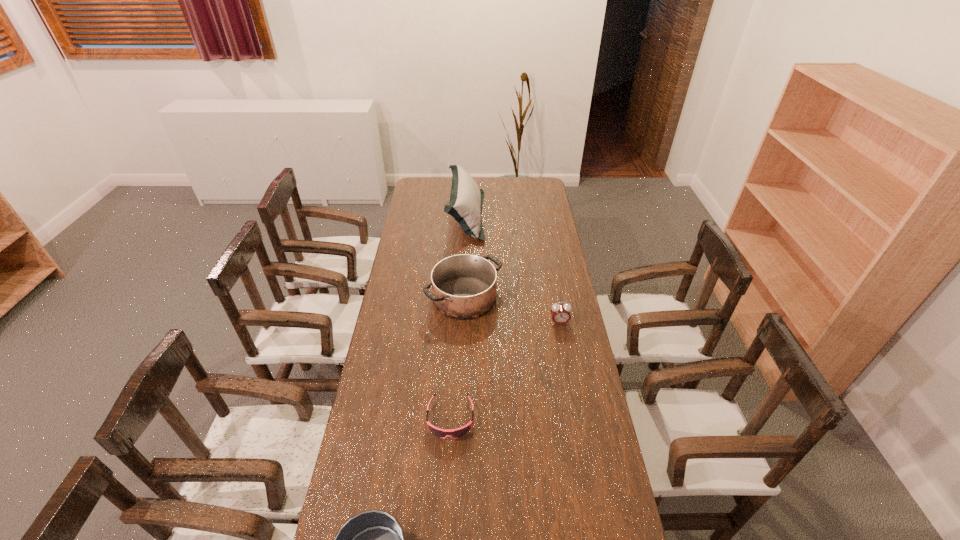
The width and height of the screenshot is (960, 540). Find the location of `object located at the far edge`. object located at the far edge is located at coordinates (466, 199).

Where is `object at the right edge`? object at the right edge is located at coordinates (560, 313).

In the image, there is a desktop. What are the coordinates of `vacant space at the left edge` in the screenshot? It's located at (398, 246).

You are a GUI agent. You are given a task and a screenshot of the screen. Output one action in this format:
    pyautogui.click(x=<x>, y=<y>)
    Task: Click on the free space at the right edge
    The height and width of the screenshot is (540, 960).
    Given the screenshot: What is the action you would take?
    pyautogui.click(x=537, y=231)

At what (x,y) coordinates should I click in order to perform the action: click on free space at the far left corner of the desktop. Please return your answer as a coordinate pair (x, y). The image size is (960, 540). Looking at the image, I should click on (412, 192).

The height and width of the screenshot is (540, 960). Find the location of `free space at the far right corner`. free space at the far right corner is located at coordinates coord(522,177).

Locate an element on the screen. The height and width of the screenshot is (540, 960). vacant area between the goggles and the rightmost object is located at coordinates [505, 370].

At what (x,y) coordinates should I click in order to perform the action: click on empty space that is in between the cushion and the alarm clock. Please return your answer as a coordinate pair (x, y). The image size is (960, 540). Looking at the image, I should click on (513, 269).

This screenshot has height=540, width=960. Find the location of `object that is the second closest one to the taller saucepan`. object that is the second closest one to the taller saucepan is located at coordinates (466, 199).

Locate an element on the screen. object that can be found as the third closest to the nearer saucepan is located at coordinates (560, 313).